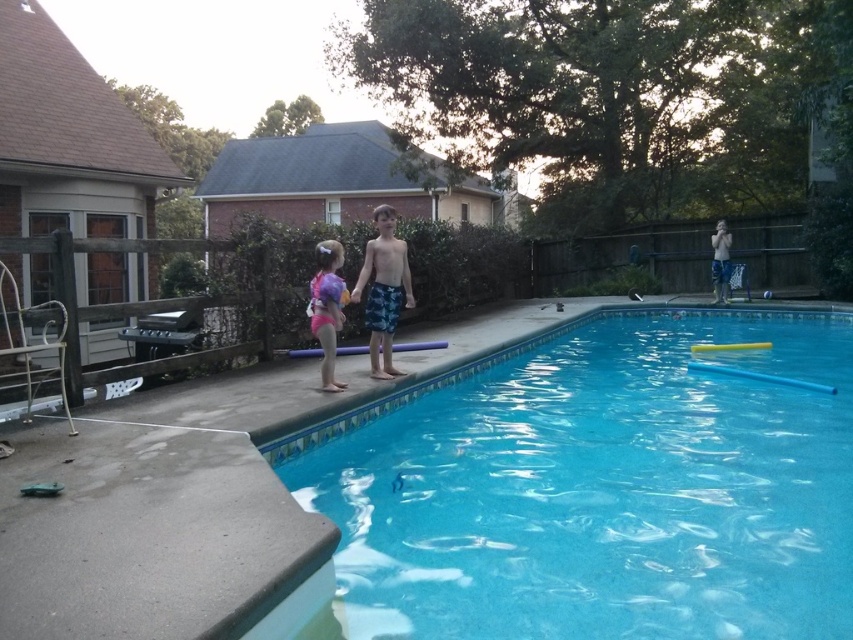
Can you confirm if blue printed shorts at center is bigger than pink fabric swimsuit at center?

Yes, blue printed shorts at center is bigger than pink fabric swimsuit at center.

Which is in front, point (367, 300) or point (337, 308)?

Point (337, 308)

Between point (392, 353) and point (334, 243), which one is positioned behind?

The point (392, 353) is behind.

The width and height of the screenshot is (853, 640). Find the location of `blue printed shorts at center`. blue printed shorts at center is located at coordinates (383, 289).

Does pink fabric swimsuit at center lie behind blue textured shorts at upper right?

No, pink fabric swimsuit at center is closer to the viewer.

Can you confirm if pink fabric swimsuit at center is positioned to the right of blue textured shorts at upper right?

No, pink fabric swimsuit at center is not to the right of blue textured shorts at upper right.

This screenshot has height=640, width=853. What are the coordinates of `pink fabric swimsuit at center` in the screenshot? It's located at [328, 307].

Can you confirm if clear blue water at center is positioned to the right of blue printed shorts at center?

Indeed, clear blue water at center is positioned on the right side of blue printed shorts at center.

The image size is (853, 640). Find the location of `clear blue water at center`. clear blue water at center is located at coordinates point(598,486).